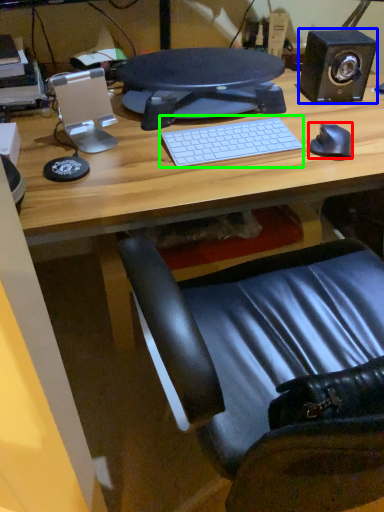
Question: Based on their relative distances, which object is nearer to mouse (highlighted by a red box)? Choose from speaker (highlighted by a blue box) and computer keyboard (highlighted by a green box).

Choices:
 (A) speaker
 (B) computer keyboard

Answer: (B)